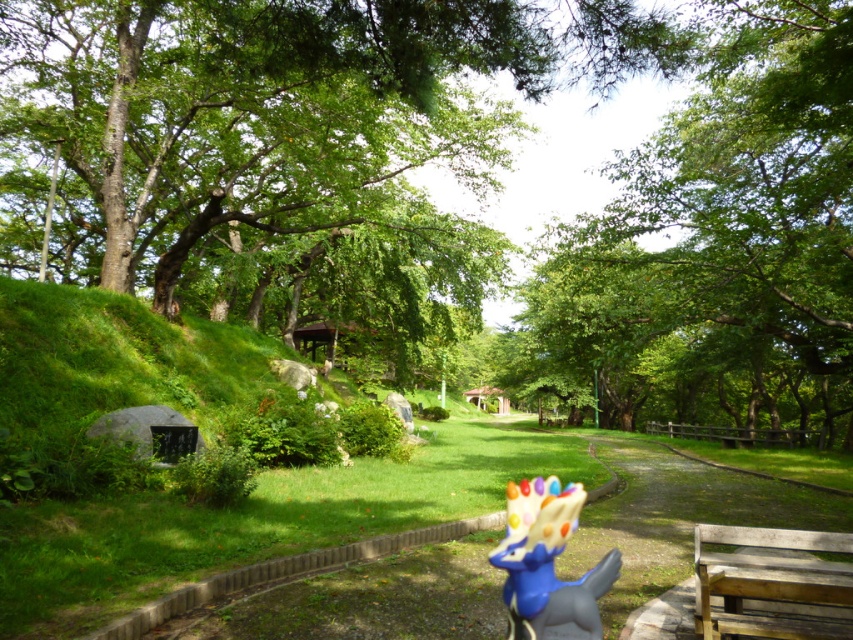
Question: Can you confirm if green leafy tree at upper center is positioned to the left of wooden bench at lower right?

Choices:
 (A) no
 (B) yes

Answer: (A)

Question: Which point is farther from the camera taking this photo?

Choices:
 (A) (527, 557)
 (B) (622, 428)

Answer: (B)

Question: Which point is closer to the camera?

Choices:
 (A) (809, 412)
 (B) (508, 554)
 (C) (718, 621)

Answer: (B)

Question: Is green leafy tree at upper center above shiny plastic toy at center?

Choices:
 (A) no
 (B) yes

Answer: (B)

Question: Does wooden bench at lower right appear under shiny plastic toy at center?

Choices:
 (A) no
 (B) yes

Answer: (B)

Question: Which point is farther to the camera?

Choices:
 (A) (541, 620)
 (B) (752, 420)
 (C) (828, 595)

Answer: (B)